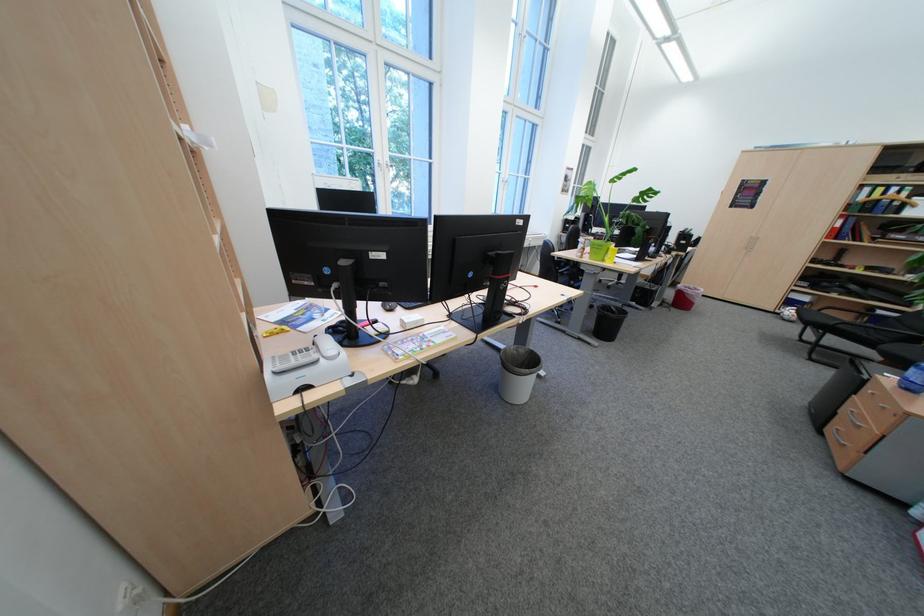
The height and width of the screenshot is (616, 924). What do you see at coordinates (861, 326) in the screenshot?
I see `a black chair sitting surface` at bounding box center [861, 326].